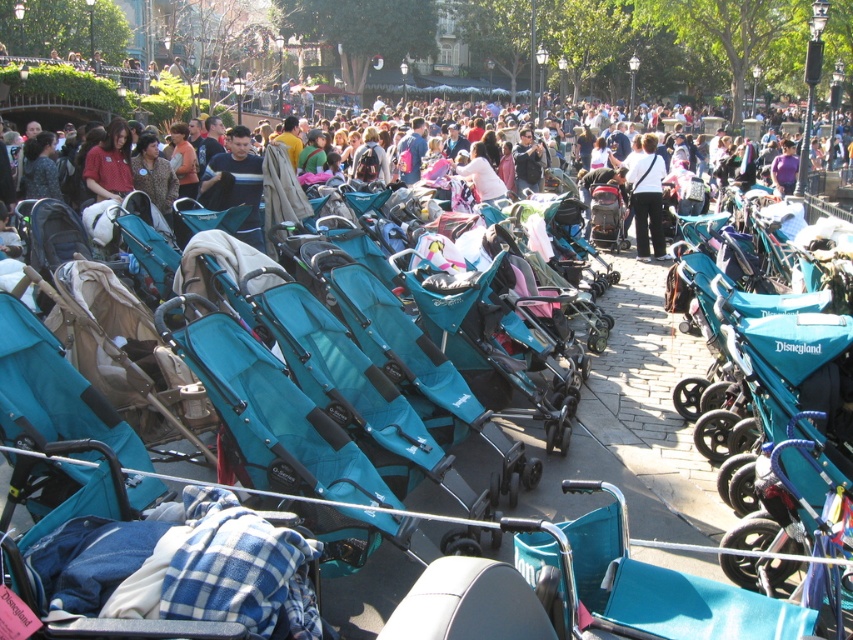
Is point (642, 209) closer to camera compared to point (248, 170)?

No, it is behind (248, 170).

This screenshot has height=640, width=853. Describe the element at coordinates (647, 198) in the screenshot. I see `dark blue jeans at center` at that location.

Between point (636, 236) and point (236, 184), which one is positioned in front?

Point (236, 184) is more forward.

In order to click on dark blue jeans at center in this screenshot , I will do `click(647, 198)`.

Is point (405, 525) closer to camera compared to point (125, 170)?

Yes, point (405, 525) is closer to viewer.

Does point (345, 548) lie behind point (108, 156)?

No.

Between point (344, 572) and point (112, 128), which one is positioned behind?

The point (112, 128) is behind.

The width and height of the screenshot is (853, 640). What are the coordinates of `teal fabric stroller at center` in the screenshot? It's located at (270, 413).

Is dark blue jeans at center smaller than matte red shirt at upper left?

Actually, dark blue jeans at center might be larger than matte red shirt at upper left.

Image resolution: width=853 pixels, height=640 pixels. What do you see at coordinates (647, 198) in the screenshot?
I see `dark blue jeans at center` at bounding box center [647, 198].

Is point (660, 172) positioned after point (112, 120)?

Yes, it is behind point (112, 120).

Locate an element on the screen. The width and height of the screenshot is (853, 640). dark blue jeans at center is located at coordinates [647, 198].